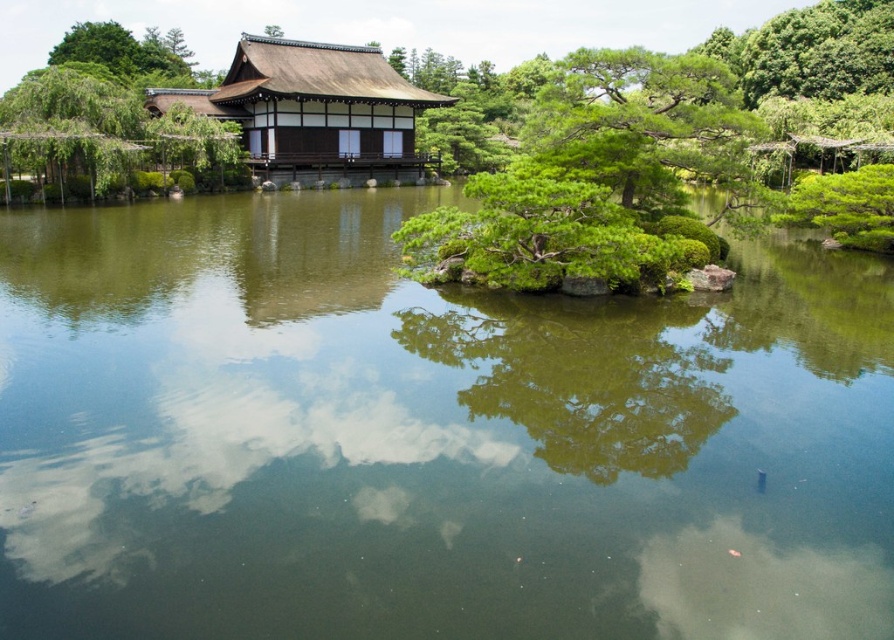
Question: Which point is closer to the camera?

Choices:
 (A) (69, 458)
 (B) (682, 97)

Answer: (A)

Question: From the image, what is the correct spatial relationship of green reflective water at center in relation to green textured pine tree at upper right?

Choices:
 (A) below
 (B) above

Answer: (A)

Question: Does green reflective water at center lie in front of green textured pine tree at upper right?

Choices:
 (A) no
 (B) yes

Answer: (B)

Question: Which point appears closest to the camera in this image?

Choices:
 (A) (625, 88)
 (B) (60, 449)

Answer: (B)

Question: Is green reflective water at center above green textured pine tree at upper right?

Choices:
 (A) no
 (B) yes

Answer: (A)